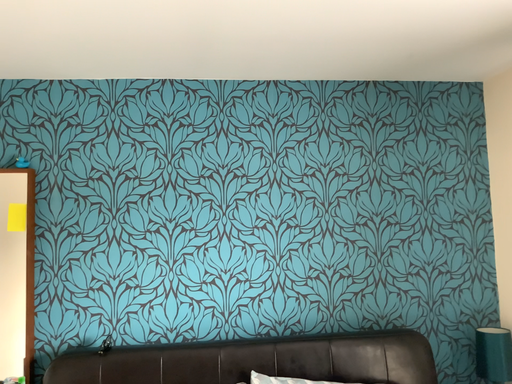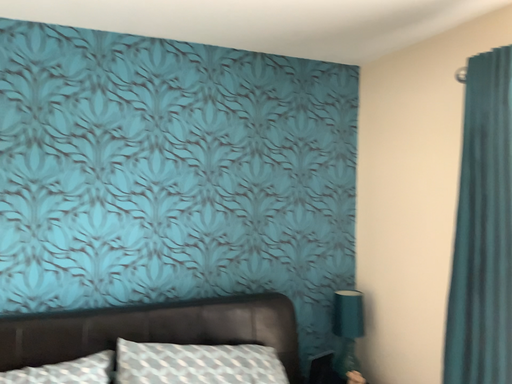
Question: Which way did the camera rotate in the video?

Choices:
 (A) rotated left
 (B) rotated right

Answer: (B)